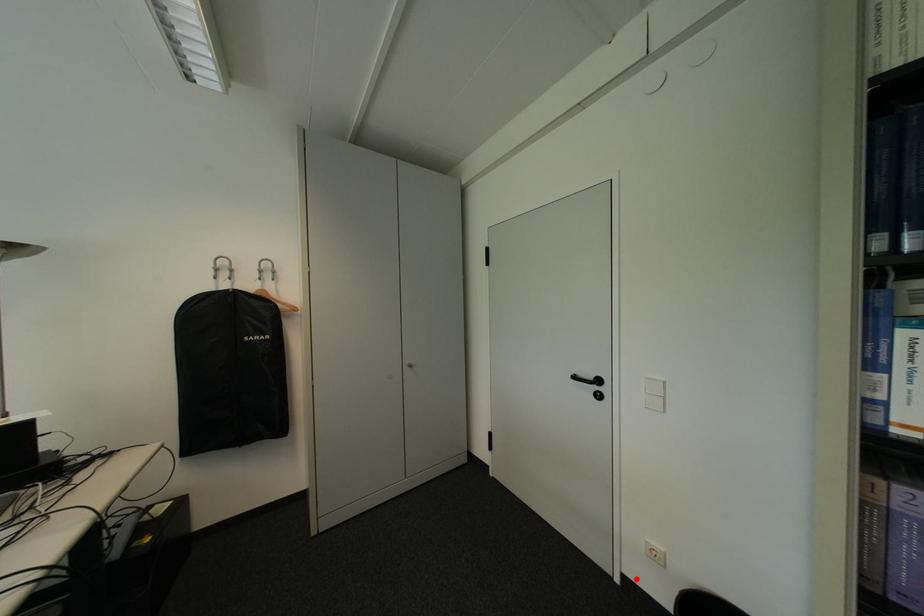
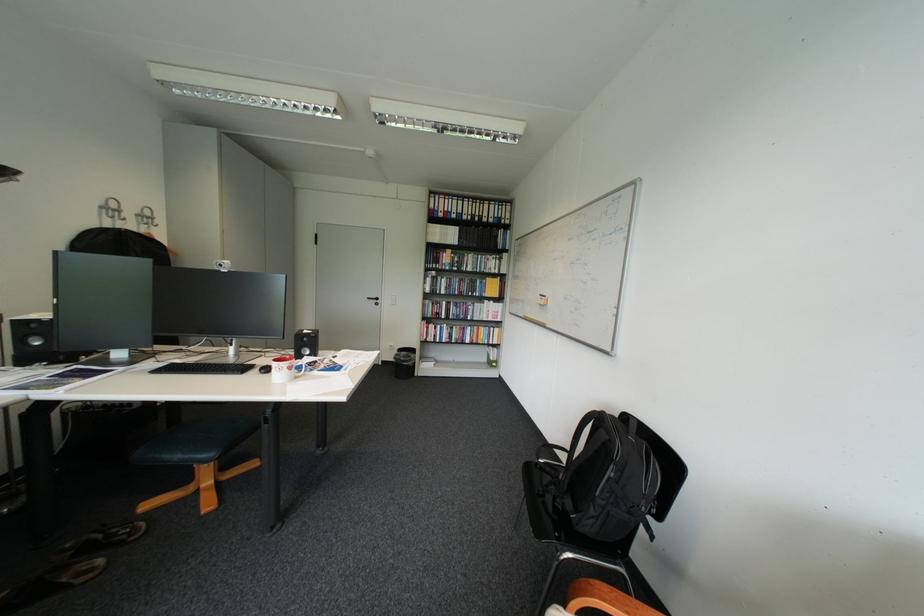
Locate, in the second image, the point that corresponds to the highlighted location in the first image.

(395, 362)